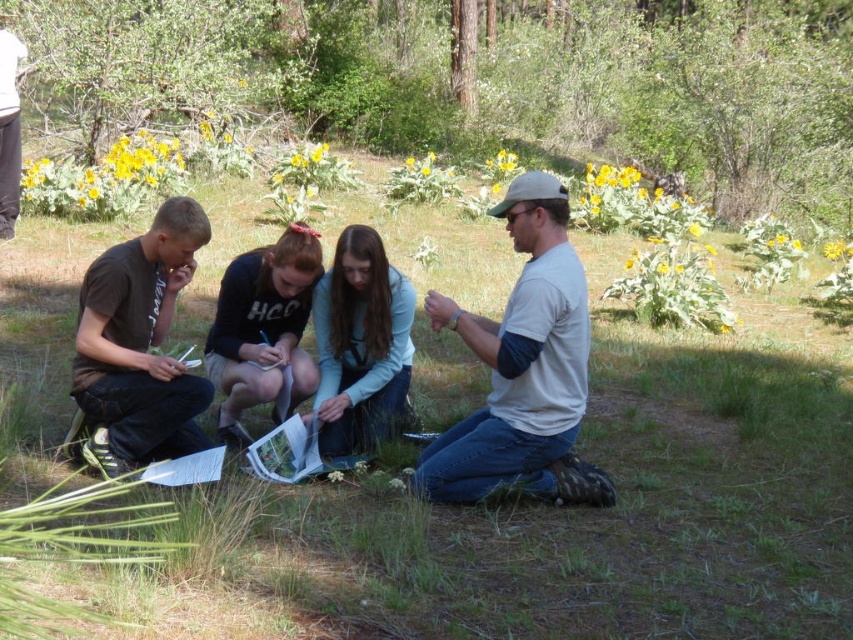
You are an observer standing in the wooded area. You notice the brown cotton shirt at left and the light blue fabric at center. Which object is taller?

The brown cotton shirt at left is taller than the light blue fabric at center.

You are standing at the origin point in the image. Which direction should you move to reach the brown cotton shirt at left?

The brown cotton shirt at left is located at coordinates 0.541 on the x and 0.164 on the y, so you should move right and slightly forward to reach it.